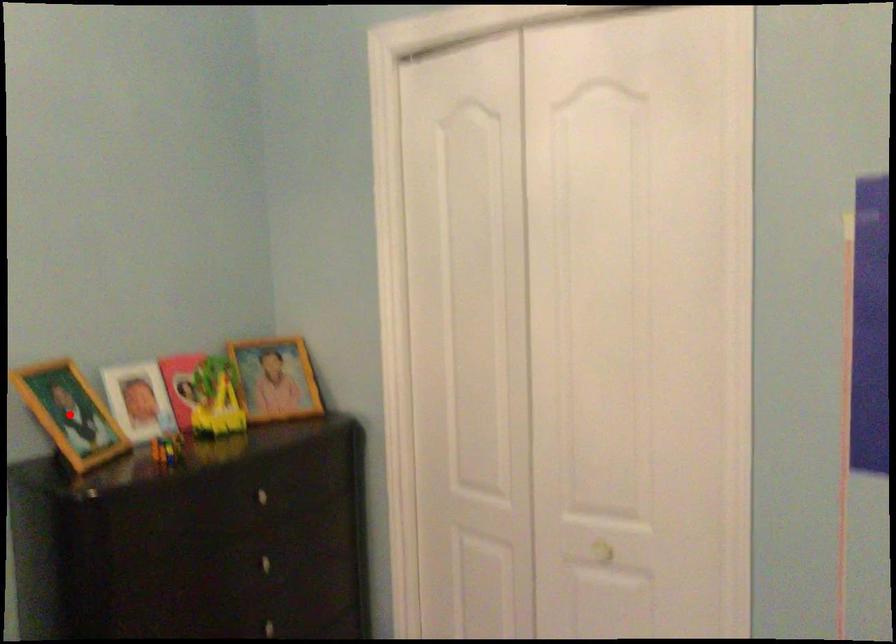
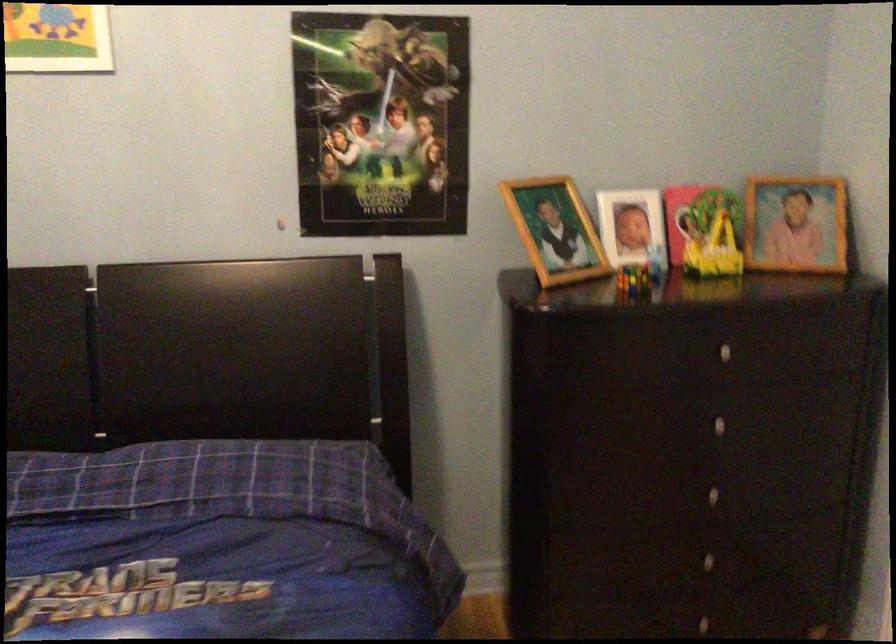
Find the pixel in the second image that matches the highlighted location in the first image.

(555, 230)